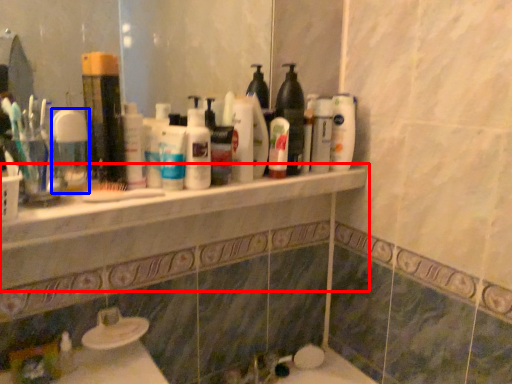
Question: Which point is closer to the camera, counter top (highlighted by a red box) or mouthwash (highlighted by a blue box)?

Choices:
 (A) counter top
 (B) mouthwash

Answer: (A)